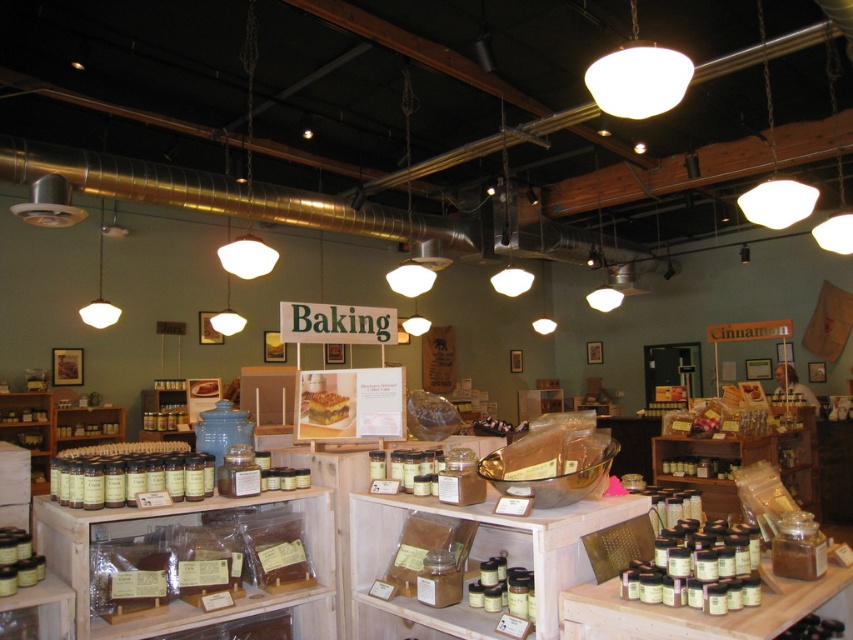
Looking at this image, you are a customer in the store and want to reach the golden brown cake at center. However, the matte wood spice rack at lower left is blocking your path. Can you walk around it to get to the cake?

The golden brown cake at center is behind the matte wood spice rack at lower left, so you can walk around the matte wood spice rack at lower left to reach the cake.

You are a customer in the store and want to reach the golden brown cake at center. The matte wood spice rack at lower left is blocking your path. Can you step around it to get to the cake?

The matte wood spice rack at lower left is taller than golden brown cake at center, so it might block your view but stepping around it should be possible as height doesn

You are a baker who needs to place a new golden brown cake at center onto the matte wood spice rack at lower left. Can the cake fit on the spice rack based on their widths?

The matte wood spice rack at lower left might be wider than golden brown cake at center, so there is a possibility that the cake can fit on the spice rack. However, the exact width of both items is not specified, so it is uncertain.